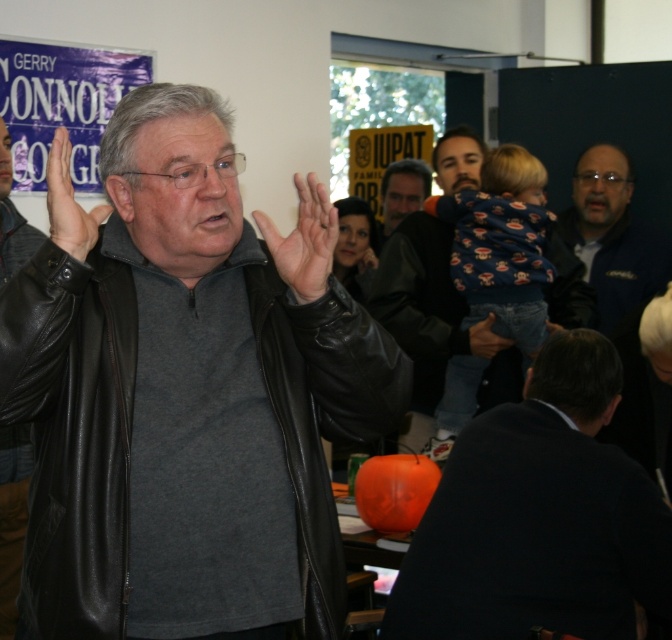
Question: Among these objects, which one is farthest from the camera?

Choices:
 (A) leather at center
 (B) dark gray leather jacket at center

Answer: (B)

Question: Which point is closer to the camera taking this photo?

Choices:
 (A) (58, 237)
 (B) (58, 305)

Answer: (B)

Question: Is black leather jacket at center wider than leather at center?

Choices:
 (A) no
 (B) yes

Answer: (B)

Question: Which point is farther to the camera?

Choices:
 (A) dark gray leather jacket at center
 (B) black leather jacket at center
 (C) smooth gray shirt at center

Answer: (C)

Question: Can you confirm if leather jacket at center is positioned above smooth gray shirt at center?

Choices:
 (A) no
 (B) yes

Answer: (A)

Question: Is dark gray leather jacket at center closer to camera compared to smooth gray shirt at center?

Choices:
 (A) yes
 (B) no

Answer: (A)